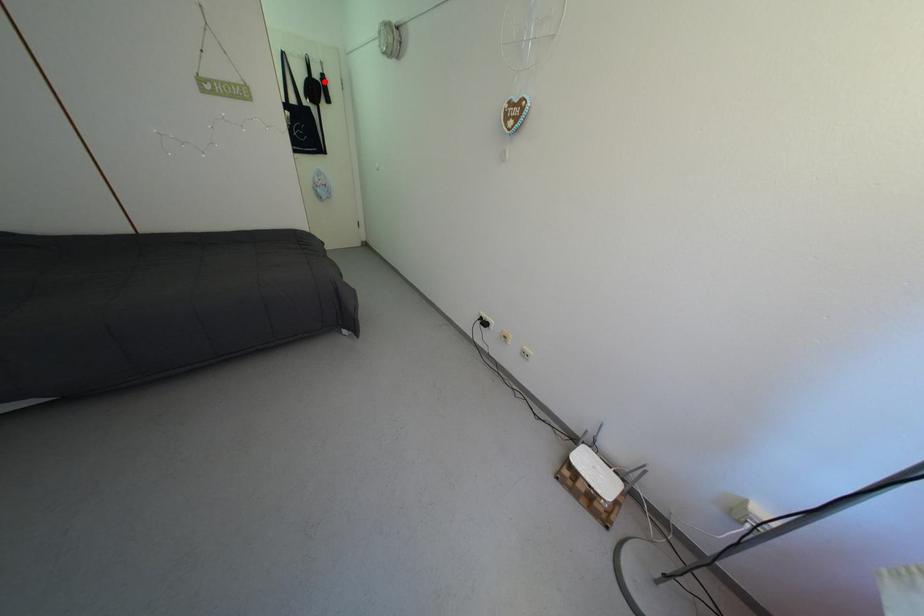
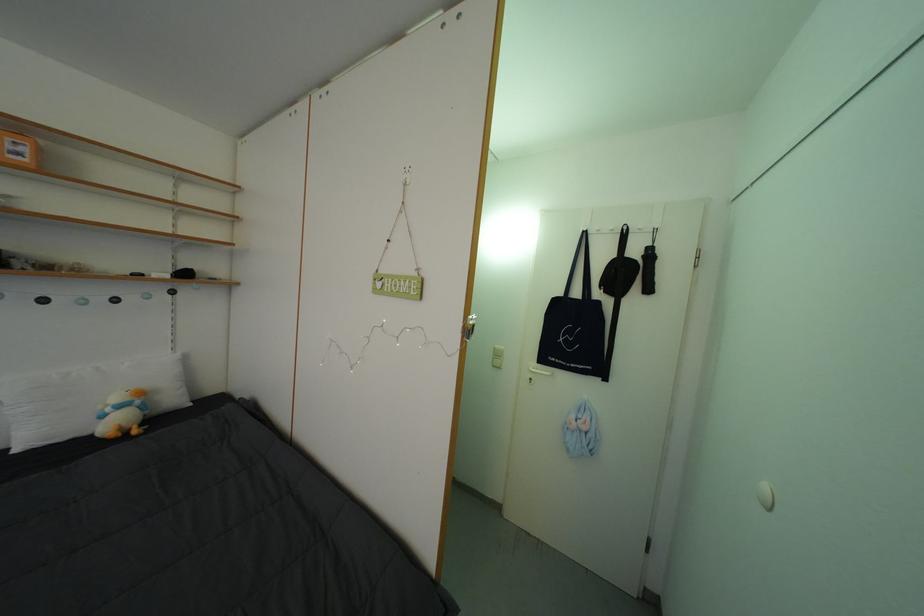
The point at the highlighted location is marked in the first image. Where is the corresponding point in the second image?

(642, 257)